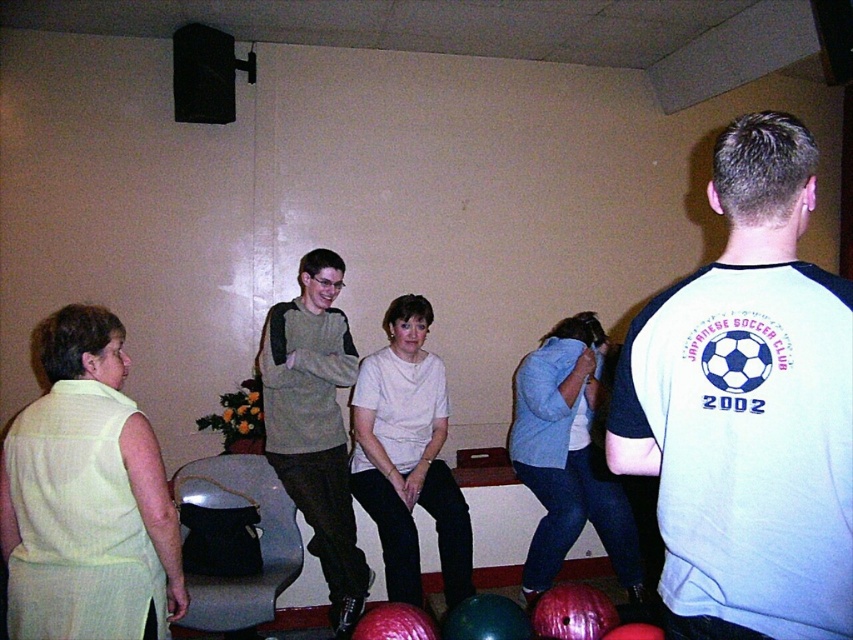
Is white jersey at center smaller than light gray sweater at center?

Yes, white jersey at center is smaller than light gray sweater at center.

In order to click on white jersey at center in this screenshot , I will do `click(747, 410)`.